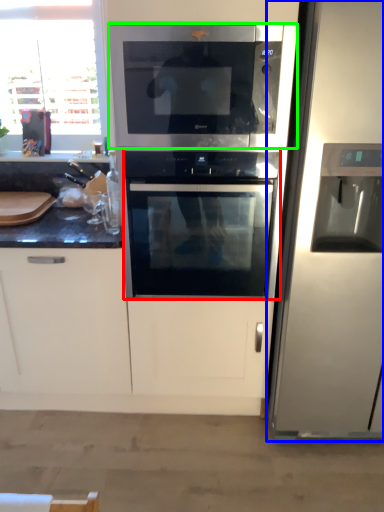
Question: Which is farther away from oven (highlighted by a red box)? refrigerator (highlighted by a blue box) or microwave oven (highlighted by a green box)?

Choices:
 (A) refrigerator
 (B) microwave oven

Answer: (A)